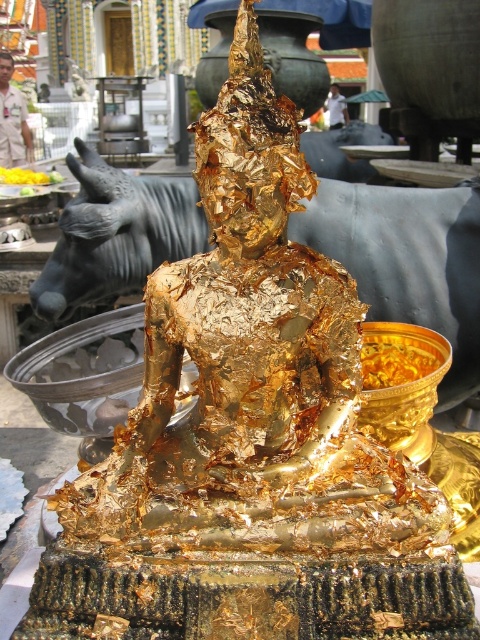
Which is behind, point (193, 195) or point (384, 385)?

The point (193, 195) is more distant.

Between point (440, 276) and point (368, 342), which one is positioned in front?

Positioned in front is point (368, 342).

This screenshot has height=640, width=480. Describe the element at coordinates (407, 260) in the screenshot. I see `black polished stone bull at center` at that location.

You are a GUI agent. You are given a task and a screenshot of the screen. Output one action in this format:
    pyautogui.click(x=<x>, y=<y>)
    Task: Click on the black polished stone bull at center
    Image resolution: width=480 pixels, height=640 pixels.
    Given the screenshot: What is the action you would take?
    pyautogui.click(x=407, y=260)

Does gold flake food at center appear on the right side of yellow flower petals at center?

Indeed, gold flake food at center is positioned on the right side of yellow flower petals at center.

Between point (403, 348) and point (26, 170), which one is positioned behind?

Point (26, 170)

The height and width of the screenshot is (640, 480). What do you see at coordinates (396, 358) in the screenshot?
I see `gold flake food at center` at bounding box center [396, 358].

This screenshot has height=640, width=480. Identify the location of gold flake food at center. (396, 358).

Is black polished stone bull at center to the right of yellow flower petals at center from the viewer's perspective?

Yes, black polished stone bull at center is to the right of yellow flower petals at center.

Which is in front, point (74, 248) or point (0, 180)?

Positioned in front is point (74, 248).

The image size is (480, 640). Identify the location of black polished stone bull at center. (407, 260).

At what (x,y) coordinates should I click in order to perform the action: click on black polished stone bull at center. Please return your answer as a coordinate pair (x, y). Image resolution: width=480 pixels, height=640 pixels. Looking at the image, I should click on (x=407, y=260).